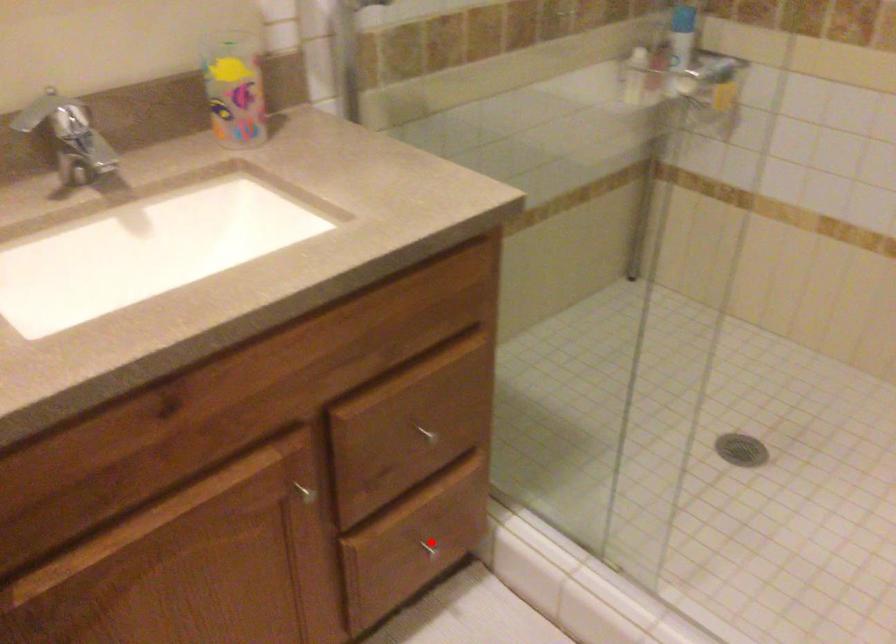
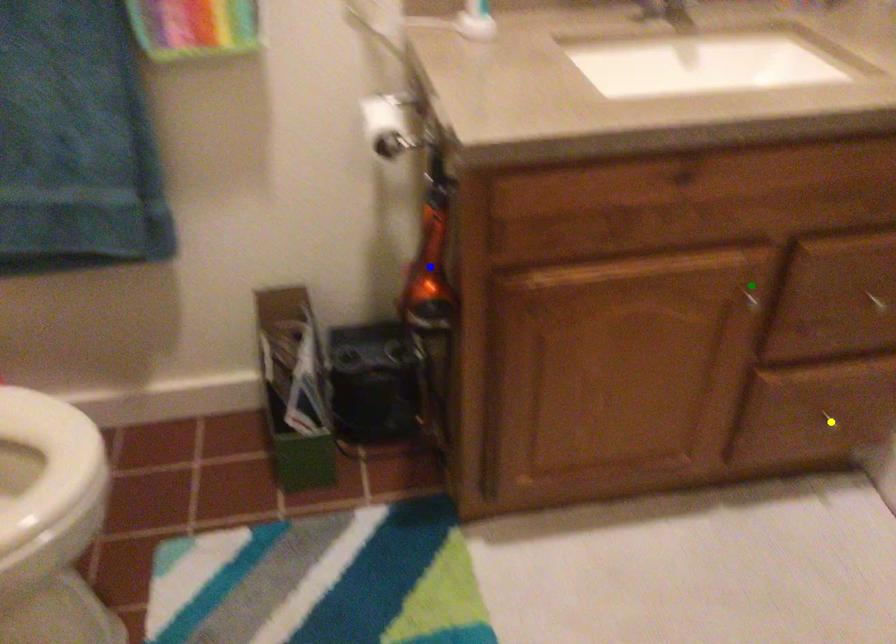
Question: I am providing you with two images of the same scene from different viewpoints. A red point is marked on the first image. You are given multiple points on the second image. Which spot in image 2 lines up with the point in image 1?

Choices:
 (A) yellow point
 (B) green point
 (C) blue point

Answer: (A)